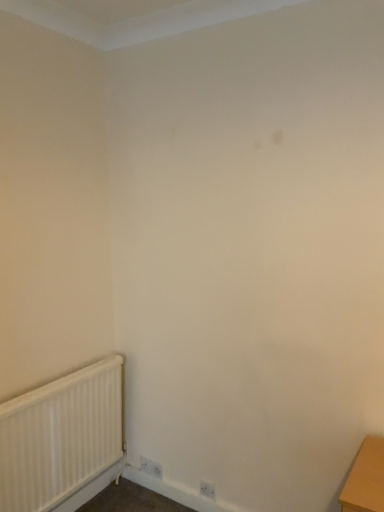
Question: Considering the positions of white plastic radiator at lower left and white plastic electric outlet at lower center in the image, is white plastic radiator at lower left bigger or smaller than white plastic electric outlet at lower center?

Choices:
 (A) big
 (B) small

Answer: (A)

Question: From the image's perspective, relative to white plastic electric outlet at lower center, is white plastic radiator at lower left above or below?

Choices:
 (A) below
 (B) above

Answer: (B)

Question: From a real-world perspective, relative to white plastic electric outlet at lower center, is white plastic radiator at lower left vertically above or below?

Choices:
 (A) above
 (B) below

Answer: (A)

Question: Based on their positions, is white plastic electric outlet at lower center located to the left or right of white plastic radiator at lower left?

Choices:
 (A) left
 (B) right

Answer: (B)

Question: In terms of width, does white plastic electric outlet at lower center look wider or thinner when compared to white plastic radiator at lower left?

Choices:
 (A) thin
 (B) wide

Answer: (A)

Question: From a real-world perspective, is white plastic electric outlet at lower center physically located above or below white plastic radiator at lower left?

Choices:
 (A) below
 (B) above

Answer: (A)

Question: Is white plastic electric outlet at lower center bigger or smaller than white plastic radiator at lower left?

Choices:
 (A) big
 (B) small

Answer: (B)